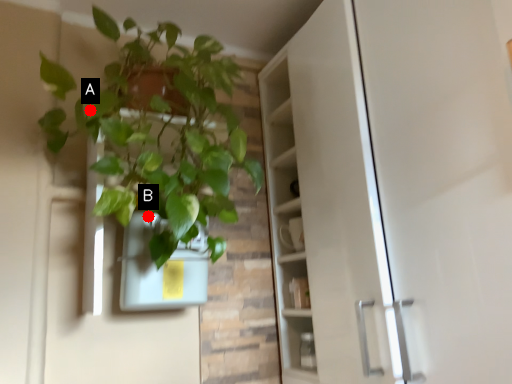
Question: Two points are circled on the image, labeled by A and B beside each circle. Among these points, which one is farthest from the camera?

Choices:
 (A) A is further
 (B) B is further

Answer: (B)